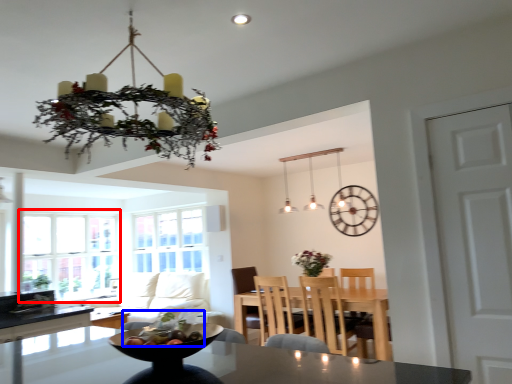
Question: Among these objects, which one is farthest to the camera, window (highlighted by a red box) or food (highlighted by a blue box)?

Choices:
 (A) window
 (B) food

Answer: (A)